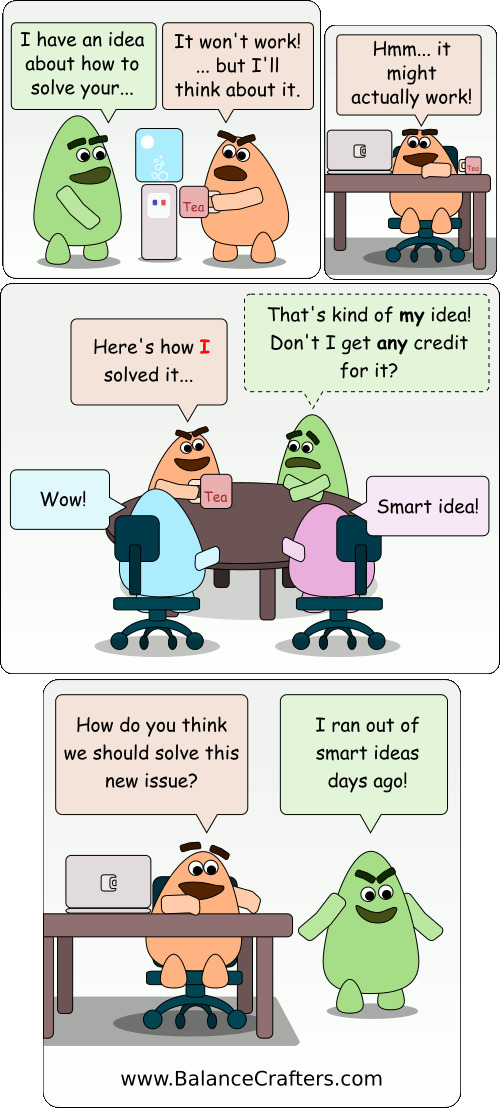
Locate an element on the screen. Image resolution: width=500 pixels, height=1108 pixels. table is located at coordinates (236, 523).